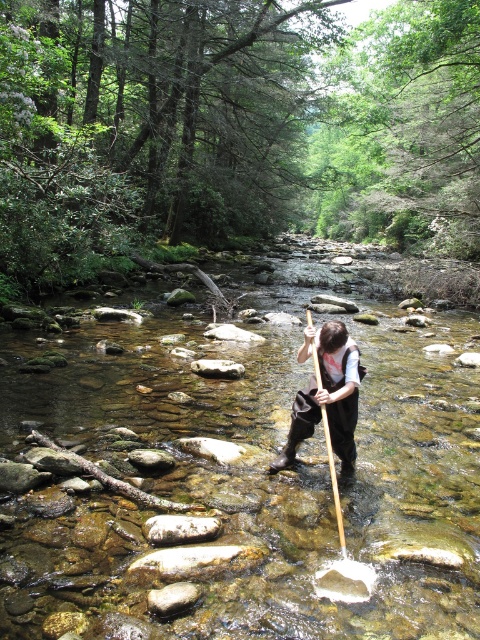
You are standing at the point closest to the person in the stream. Which of the two points, point (300, 348) or point (328, 456), is farther away from you?

Point (300, 348) is farther away because it is behind point (328, 456), which is closer to you.

Based on the photo, you are a hiker trying to cross the stream safely. You notice the brown leather boots at center in the water. Based on their position, can you determine if the boots are on a stable rock or in deeper water?

The brown leather boots at center is located at point (326,396), which is on a stable rock since the coordinates indicate a position where rocks are present and not submerged deeply.

You are a hiker trying to cross the clear stone river at center while wearing brown leather boots at center. Which direction should you step towards to avoid the water?

The clear stone river at center is to the right of brown leather boots at center, so stepping to the left would avoid the water.